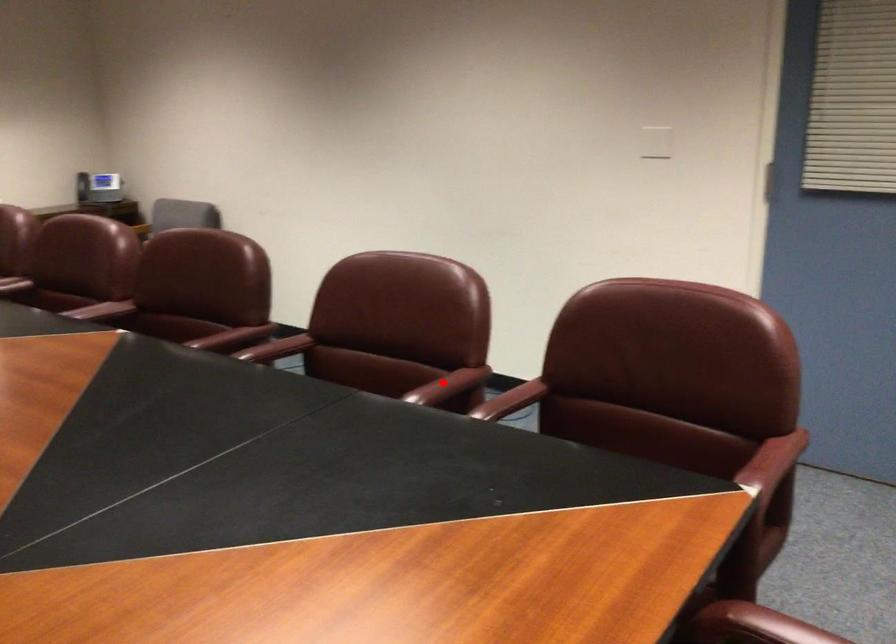
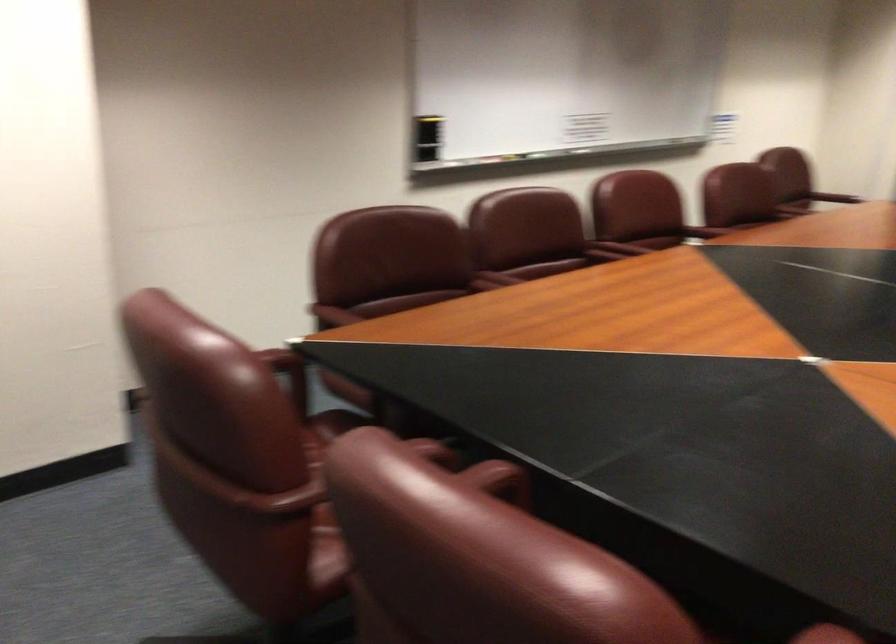
Find the pixel in the second image that matches the highlighted location in the first image.

(495, 478)